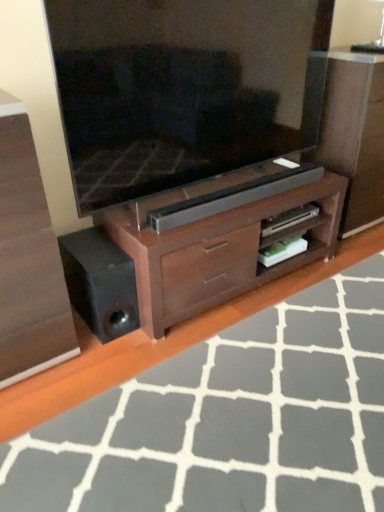
In order to click on brown wood tv cabinet at center in this screenshot , I will do `click(216, 248)`.

The height and width of the screenshot is (512, 384). Identify the location of matte wood chest of drawers at center. (28, 259).

What is the approximate width of wooden dresser at center?

wooden dresser at center is 20.35 inches wide.

Locate an element on the screen. The width and height of the screenshot is (384, 512). wooden dresser at center is located at coordinates (354, 135).

The image size is (384, 512). I want to click on matte black television at center, so point(183,88).

The width and height of the screenshot is (384, 512). In order to click on tv cabinet on the right of matte wood chest of drawers at center in this screenshot , I will do `click(216, 248)`.

From the picture: Does matte wood chest of drawers at center appear on the left side of brown wood tv cabinet at center?

Indeed, matte wood chest of drawers at center is positioned on the left side of brown wood tv cabinet at center.

Considering the points (3, 283) and (152, 262), which point is behind, point (3, 283) or point (152, 262)?

Positioned behind is point (152, 262).

Which object is more forward, matte wood chest of drawers at center or brown wood tv cabinet at center?

matte wood chest of drawers at center is closer to the camera.

Locate an element on the screen. The height and width of the screenshot is (512, 384). dresser located above the wooden floor at lower center (from the image's perspective) is located at coordinates (354, 135).

Does wooden dresser at center have a greater width compared to wooden floor at lower center?

No, wooden dresser at center is not wider than wooden floor at lower center.

Is wooden dresser at center located outside wooden floor at lower center?

Yes, wooden dresser at center is outside of wooden floor at lower center.

Which of these two, wooden dresser at center or wooden floor at lower center, is bigger?

wooden dresser at center is bigger.

Are wooden floor at lower center and brown wood tv cabinet at center far apart?

wooden floor at lower center is actually quite close to brown wood tv cabinet at center.

Considering the relative positions of wooden floor at lower center and brown wood tv cabinet at center in the image provided, is wooden floor at lower center to the left of brown wood tv cabinet at center from the viewer's perspective?

No.

Does wooden floor at lower center have a lesser height compared to brown wood tv cabinet at center?

Indeed, wooden floor at lower center has a lesser height compared to brown wood tv cabinet at center.

From a real-world perspective, relative to brown wood tv cabinet at center, is wooden floor at lower center vertically above or below?

wooden floor at lower center is below brown wood tv cabinet at center.

Is matte wood chest of drawers at center to the left or to the right of wooden dresser at center in the image?

Answer: matte wood chest of drawers at center is to the left of wooden dresser at center.

Is matte wood chest of drawers at center turned away from wooden dresser at center?

No, wooden dresser at center is not at the back of matte wood chest of drawers at center.

From a real-world perspective, is matte wood chest of drawers at center above or below wooden dresser at center?

matte wood chest of drawers at center is below wooden dresser at center.

Does matte wood chest of drawers at center have a greater width compared to wooden dresser at center?

Yes, matte wood chest of drawers at center is wider than wooden dresser at center.

In order to click on the chest of drawers behind the wooden floor at lower center in this screenshot , I will do `click(28, 259)`.

How different are the orientations of wooden floor at lower center and matte wood chest of drawers at center in degrees?

Result: The facing directions of wooden floor at lower center and matte wood chest of drawers at center are 88 degrees apart.

Is wooden floor at lower center aimed at matte wood chest of drawers at center?

No.

Which is in front, point (75, 508) or point (59, 298)?

The point (75, 508) is closer.

What's the angular difference between matte wood chest of drawers at center and wooden floor at lower center's facing directions?

matte wood chest of drawers at center and wooden floor at lower center are facing 88 degrees away from each other.

Considering the relative sizes of matte wood chest of drawers at center and wooden floor at lower center in the image provided, is matte wood chest of drawers at center bigger than wooden floor at lower center?

Correct, matte wood chest of drawers at center is larger in size than wooden floor at lower center.

Considering the sizes of matte wood chest of drawers at center and wooden floor at lower center in the image, is matte wood chest of drawers at center taller or shorter than wooden floor at lower center?

Considering their sizes, matte wood chest of drawers at center has more height than wooden floor at lower center.

Considering the sizes of matte black television at center and matte wood chest of drawers at center in the image, is matte black television at center taller or shorter than matte wood chest of drawers at center?

matte black television at center is shorter than matte wood chest of drawers at center.

Is point (285, 7) in front of point (11, 174)?

No, (285, 7) is behind (11, 174).

From a real-world perspective, is matte black television at center located higher than matte wood chest of drawers at center?

Indeed, from a real-world perspective, matte black television at center stands above matte wood chest of drawers at center.

Considering the relative sizes of matte black television at center and matte wood chest of drawers at center in the image provided, is matte black television at center wider than matte wood chest of drawers at center?

Incorrect, the width of matte black television at center does not surpass that of matte wood chest of drawers at center.

Where is `chest of drawers in front of the brown wood tv cabinet at center`? The height and width of the screenshot is (512, 384). chest of drawers in front of the brown wood tv cabinet at center is located at coordinates (28, 259).

This screenshot has height=512, width=384. Identify the location of dresser that appears above the wooden floor at lower center (from the image's perspective). (354, 135).

When comparing their distances from matte wood chest of drawers at center, does brown wood tv cabinet at center or matte black television at center seem closer?

Based on the image, brown wood tv cabinet at center appears to be nearer to matte wood chest of drawers at center.

Considering their positions, is wooden dresser at center positioned closer to brown wood tv cabinet at center than matte wood chest of drawers at center?

The object closer to brown wood tv cabinet at center is matte wood chest of drawers at center.

When comparing their distances from wooden dresser at center, does matte black television at center or brown wood tv cabinet at center seem closer?

brown wood tv cabinet at center.

Based on the photo, estimate the real-world distances between objects in this image. Which object is further from brown wood tv cabinet at center, wooden floor at lower center or matte black television at center?

wooden floor at lower center is further to brown wood tv cabinet at center.

Looking at the image, which one is located closer to wooden floor at lower center, matte black television at center or matte wood chest of drawers at center?

matte wood chest of drawers at center is positioned closer to the anchor wooden floor at lower center.

Looking at the image, which one is located further to brown wood tv cabinet at center, wooden dresser at center or matte black television at center?

wooden dresser at center is further to brown wood tv cabinet at center.

Considering their positions, is matte wood chest of drawers at center positioned further to wooden dresser at center than wooden floor at lower center?

matte wood chest of drawers at center is further to wooden dresser at center.

When comparing their distances from matte wood chest of drawers at center, does matte black television at center or wooden floor at lower center seem further?

matte black television at center is further to matte wood chest of drawers at center.

Identify the location of plain located between matte wood chest of drawers at center and wooden dresser at center in the left-right direction. (230, 419).

Where is `television between wooden floor at lower center and wooden dresser at center from front to back`? The image size is (384, 512). television between wooden floor at lower center and wooden dresser at center from front to back is located at coordinates (183, 88).

The height and width of the screenshot is (512, 384). In order to click on tv cabinet between matte wood chest of drawers at center and matte black television at center in this screenshot , I will do `click(216, 248)`.

Find the location of a particular element. This screenshot has height=512, width=384. tv cabinet between matte wood chest of drawers at center and wooden floor at lower center from left to right is located at coordinates (216, 248).